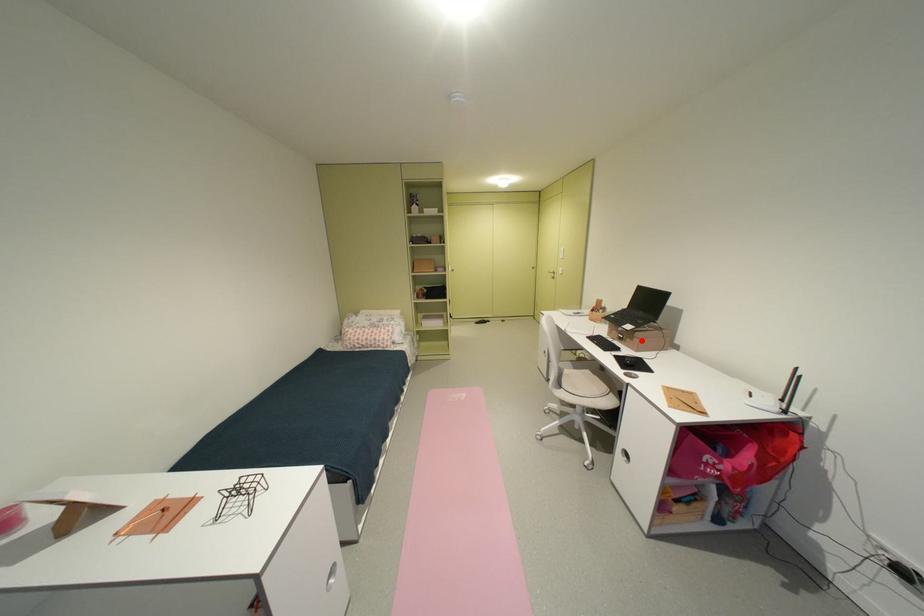
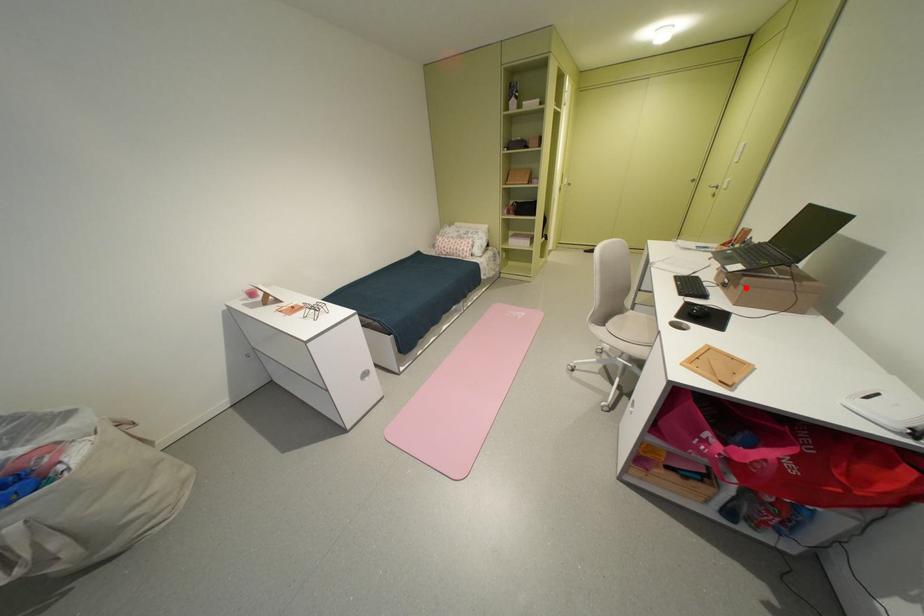
I am providing you with two images of the same scene from different viewpoints. A red point is marked on the first image and another point is marked on the second image. Are the points marked in image1 and image2 representing the same 3D position?

Yes